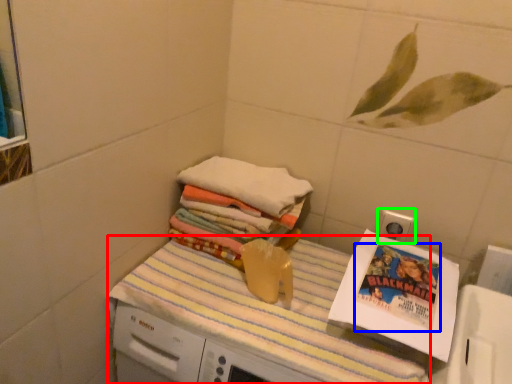
Question: Estimate the real-world distances between objects in this image. Which object is closer to tablecloth (highlighted by a red box), comic book (highlighted by a blue box) or electric outlet (highlighted by a green box)?

Choices:
 (A) comic book
 (B) electric outlet

Answer: (A)